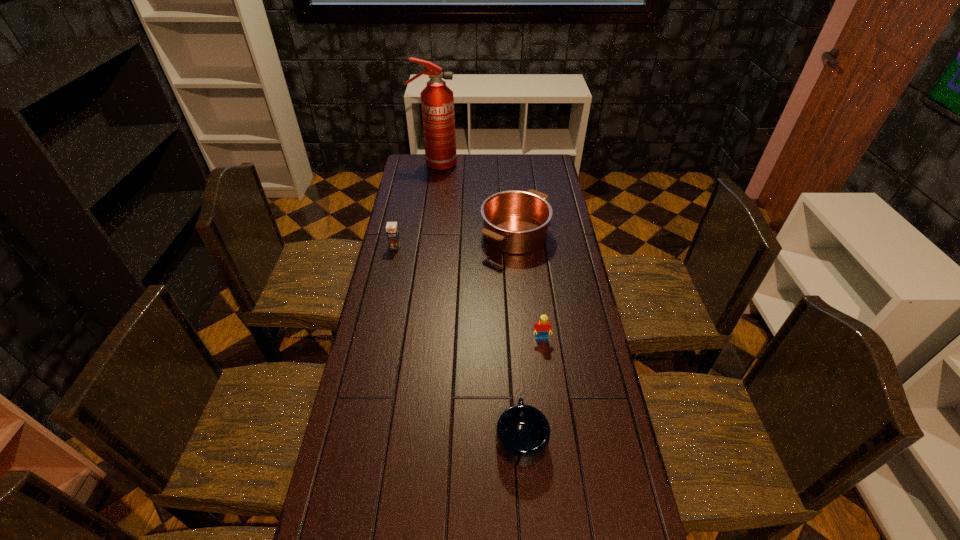
You are a GUI agent. You are given a task and a screenshot of the screen. Output one action in this format:
    pyautogui.click(x=<x>, y=<y>)
    Task: Click on the vacant space at the far edge of the desktop
    This screenshot has height=540, width=960.
    Given the screenshot: What is the action you would take?
    pyautogui.click(x=470, y=165)

Where is `vacant space at the left edge`? The width and height of the screenshot is (960, 540). vacant space at the left edge is located at coordinates (408, 191).

Find the location of a particular element. This screenshot has height=540, width=960. vacant position at the right edge of the desktop is located at coordinates (569, 401).

What are the coordinates of `free space at the far left corner of the desktop` in the screenshot? It's located at (412, 171).

Locate an element on the screen. empty location between the second nearest object and the tallest object is located at coordinates (488, 252).

Image resolution: width=960 pixels, height=540 pixels. Identify the location of free spot between the fourth farthest object and the chocolate milk. (468, 293).

You are a GUI agent. You are given a task and a screenshot of the screen. Output one action in this format:
    pyautogui.click(x=<x>, y=<y>)
    Task: Click on the empty space that is in between the chocolate milk and the Lego
    
    Given the screenshot: What is the action you would take?
    [x=468, y=293]

Where is `unoccupied area between the tallest object and the saucepan`? This screenshot has height=540, width=960. unoccupied area between the tallest object and the saucepan is located at coordinates click(475, 200).

Identify the location of free space that is in between the mug and the chocolate milk. This screenshot has width=960, height=540. (458, 342).

What are the coordinates of `object that is the closest to the second nearest object` in the screenshot? It's located at (522, 436).